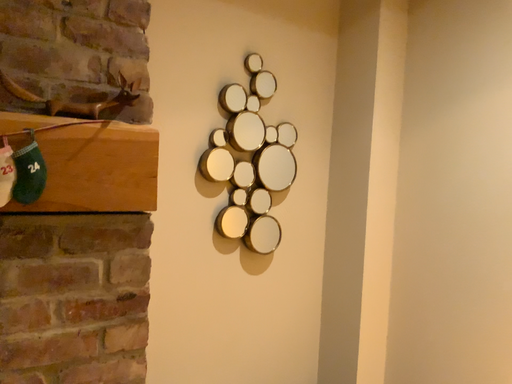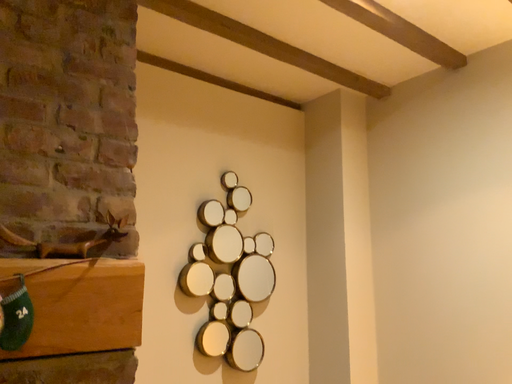
Question: Which way did the camera rotate in the video?

Choices:
 (A) rotated upward
 (B) rotated downward

Answer: (A)